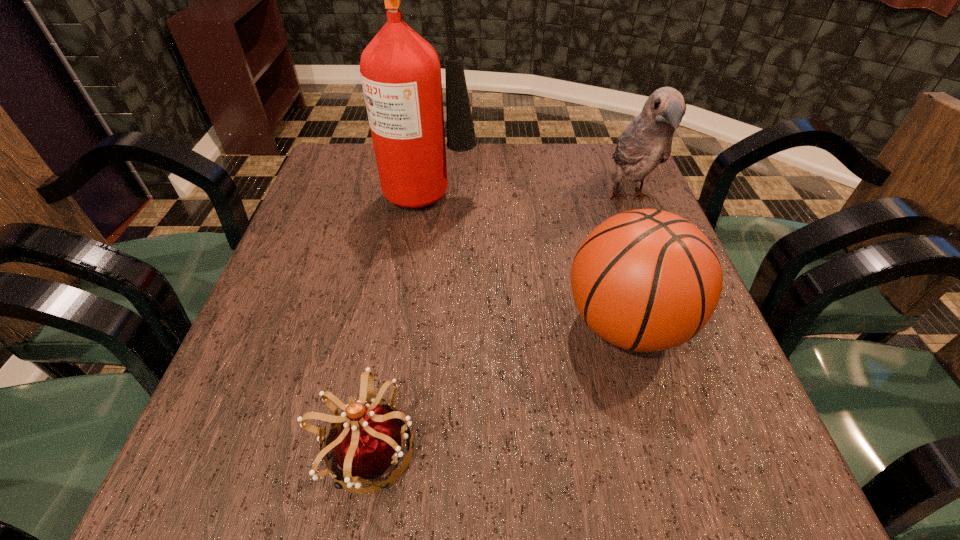
Locate an element on the screen. fire extinguisher is located at coordinates (400, 71).

Locate an element on the screen. The image size is (960, 540). parrot is located at coordinates tap(647, 141).

You are a GUI agent. You are given a task and a screenshot of the screen. Output one action in this format:
    pyautogui.click(x=<x>, y=<y>)
    Task: Click on the third farthest object
    The height and width of the screenshot is (540, 960).
    Given the screenshot: What is the action you would take?
    pyautogui.click(x=646, y=280)

At what (x,y) coordinates should I click in order to perform the action: click on basketball. Please return your answer as a coordinate pair (x, y). The height and width of the screenshot is (540, 960). Looking at the image, I should click on (646, 280).

Find the location of a particular element. The width and height of the screenshot is (960, 540). tiara is located at coordinates (369, 441).

This screenshot has height=540, width=960. What are the coordinates of `the nearest object` in the screenshot? It's located at (369, 441).

In order to click on vacant space located 0.270m at the nozzle of the tallest object in this screenshot , I will do `click(583, 190)`.

Where is `vacant space located 0.220m on the front-facing side of the parrot`? Image resolution: width=960 pixels, height=540 pixels. vacant space located 0.220m on the front-facing side of the parrot is located at coordinates (670, 305).

I want to click on vacant space located on the left of the basketball, so click(x=424, y=325).

Find the location of a particular element. vacant space located on the front-facing side of the shortest object is located at coordinates (484, 451).